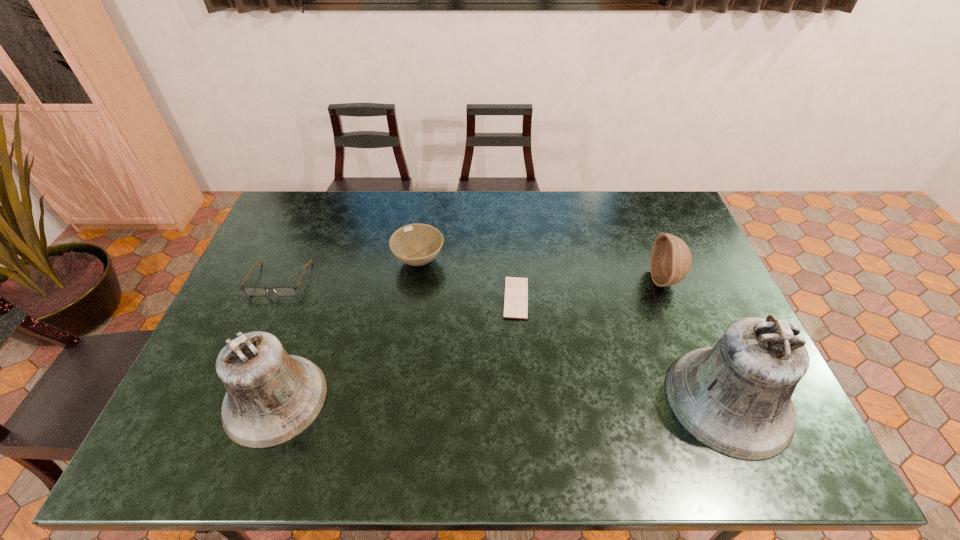
I want to click on the left bell, so click(272, 397).

I want to click on the shorter bell, so click(272, 397).

This screenshot has width=960, height=540. In order to click on the taller bell in this screenshot , I will do `click(735, 398)`.

Identify the location of the tallest object. This screenshot has height=540, width=960. (735, 398).

This screenshot has width=960, height=540. I want to click on the left bowl, so click(x=415, y=244).

Locate an element on the screen. the third shortest object is located at coordinates (415, 244).

Where is `spectacles`? Image resolution: width=960 pixels, height=540 pixels. spectacles is located at coordinates (251, 291).

Where is `the right bowl`? the right bowl is located at coordinates (671, 259).

Identify the location of the third tallest object. (671, 259).

Locate an element on the screen. The width and height of the screenshot is (960, 540). the third object from right to left is located at coordinates (516, 288).